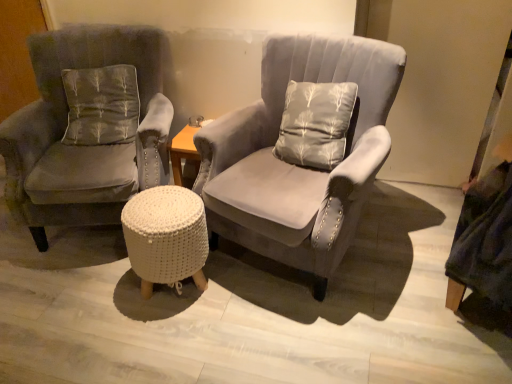
Question: Considering the positions of point (109, 129) and point (108, 124), is point (109, 129) closer or farther from the camera than point (108, 124)?

Choices:
 (A) closer
 (B) farther

Answer: (B)

Question: From their relative heights in the image, would you say velvet gray armchair at left, the 2th chair viewed from the right, is taller or shorter than gray fabric pillow at left?

Choices:
 (A) short
 (B) tall

Answer: (B)

Question: Which object is the farthest from the white knitted stool at center?

Choices:
 (A) suede gray armchair at center, the first chair viewed from the right
 (B) velvet gray armchair at left, the 2th chair viewed from the right
 (C) gray fabric pillow at left

Answer: (C)

Question: Estimate the real-world distances between objects in this image. Which object is farther from the velvet gray armchair at left, which appears as the first chair when viewed from the left?

Choices:
 (A) suede gray armchair at center, which appears as the second chair when viewed from the left
 (B) gray fabric pillow at left
 (C) white knitted stool at center

Answer: (A)